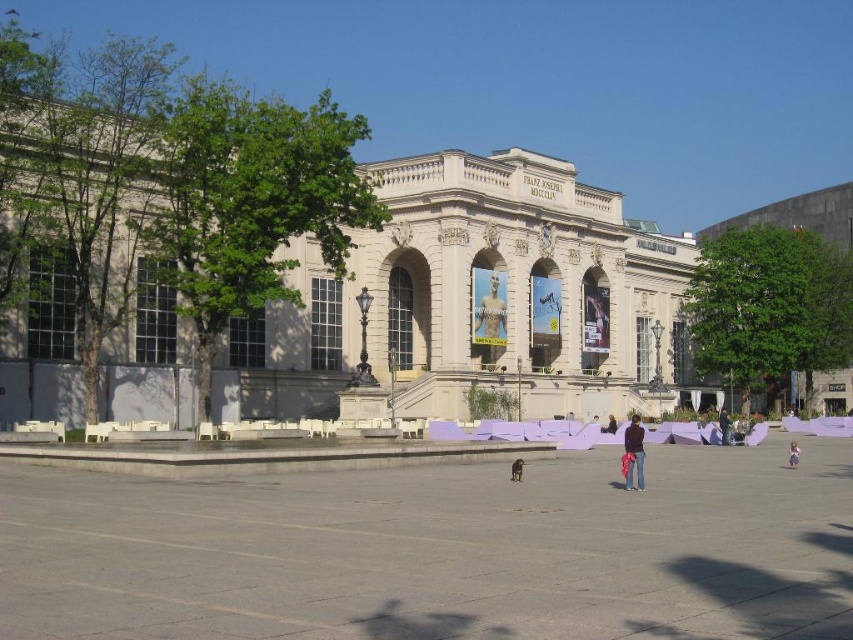
You are standing at the entrance of the classical building and see both the pink fabric at center and the black leather jacket at center in the plaza. If you want to reach both items, which one would you need to walk further to get to?

The distance between the pink fabric at center and the black leather jacket at center is 14.16 meters, so you would need to walk further to reach whichever is farther from your current position. However, since both are at the center, their relative distance from you depends on your exact location. Without knowing your starting point, it is impossible to determine which requires a longer walk.

You are standing at the entrance of the FRANZ JOSEPH WUCCUP building and notice the purple cotton pants at center. Based on their position, can you determine if they are closer to the building or the plaza edge?

The purple cotton pants at center is located at point (634, 452) which is closer to the plaza edge than the building.